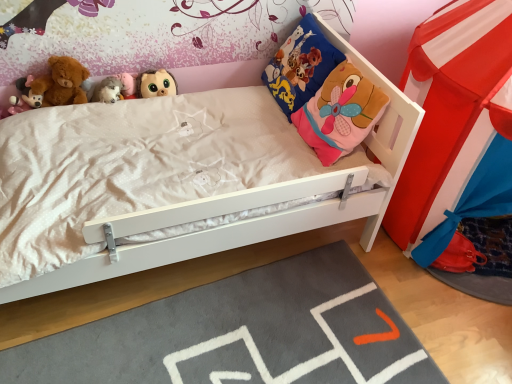
Question: From a real-world perspective, is soft plush teddy bear at upper left physically above matte pink plush toy at upper left, the first toy when ordered from left to right?

Choices:
 (A) no
 (B) yes

Answer: (B)

Question: Is soft plush teddy bear at upper left next to matte pink plush toy at upper left, the first toy when ordered from left to right, and touching it?

Choices:
 (A) no
 (B) yes

Answer: (B)

Question: Can you confirm if soft plush teddy bear at upper left is wider than matte pink plush toy at upper left, marked as the third toy in a right-to-left arrangement?

Choices:
 (A) no
 (B) yes

Answer: (B)

Question: Is soft plush teddy bear at upper left outside matte pink plush toy at upper left, marked as the third toy in a right-to-left arrangement?

Choices:
 (A) yes
 (B) no

Answer: (A)

Question: Is soft plush teddy bear at upper left shorter than matte pink plush toy at upper left, the first toy when ordered from left to right?

Choices:
 (A) no
 (B) yes

Answer: (A)

Question: From a real-world perspective, is gray soft rug at lower center above or below blue fabric pillow at upper right?

Choices:
 (A) below
 (B) above

Answer: (A)

Question: Considering their positions, is gray soft rug at lower center located in front of or behind blue fabric pillow at upper right?

Choices:
 (A) behind
 (B) front

Answer: (B)

Question: Does point (381, 327) appear closer or farther from the camera than point (300, 62)?

Choices:
 (A) closer
 (B) farther

Answer: (A)

Question: Which is correct: gray soft rug at lower center is inside blue fabric pillow at upper right, or outside of it?

Choices:
 (A) outside
 (B) inside

Answer: (A)

Question: In the image, is matte pink plush toy at upper left, the first toy when ordered from left to right, positioned in front of or behind soft plush teddy bear at upper left?

Choices:
 (A) front
 (B) behind

Answer: (A)

Question: Visually, is matte pink plush toy at upper left, marked as the third toy in a right-to-left arrangement, positioned to the left or to the right of soft plush teddy bear at upper left?

Choices:
 (A) left
 (B) right

Answer: (A)

Question: Is matte pink plush toy at upper left, marked as the third toy in a right-to-left arrangement, situated inside soft plush teddy bear at upper left or outside?

Choices:
 (A) outside
 (B) inside

Answer: (A)

Question: In terms of height, does matte pink plush toy at upper left, marked as the third toy in a right-to-left arrangement, look taller or shorter compared to soft plush teddy bear at upper left?

Choices:
 (A) tall
 (B) short

Answer: (B)

Question: Is matte pink plush toy at upper left, marked as the third toy in a right-to-left arrangement, in front of or behind gray soft rug at lower center in the image?

Choices:
 (A) front
 (B) behind

Answer: (B)

Question: Visually, is matte pink plush toy at upper left, the first toy when ordered from left to right, positioned to the left or to the right of gray soft rug at lower center?

Choices:
 (A) right
 (B) left

Answer: (B)